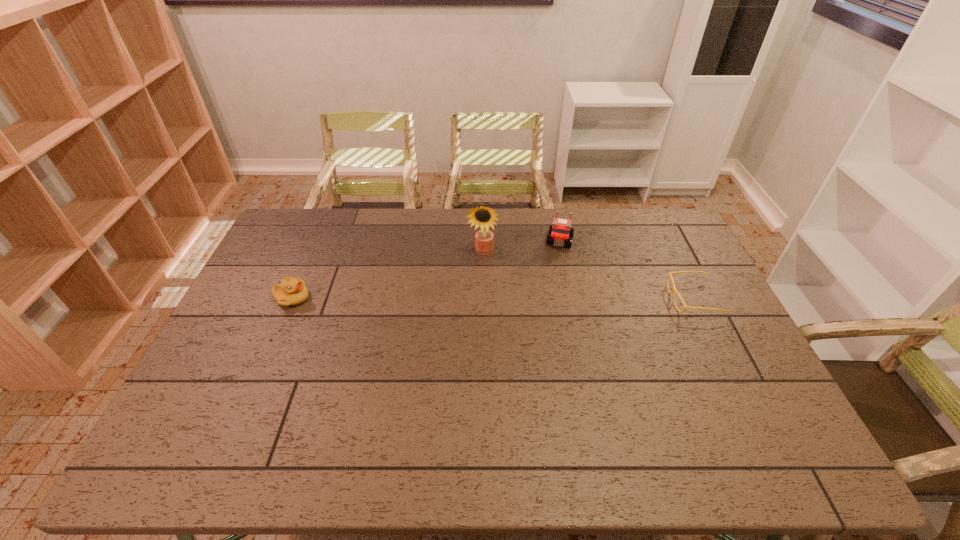
Identify the location of vacant space on the desktop that is between the third tallest object and the shortest object and is positioned on the face of the third object from right to left. The width and height of the screenshot is (960, 540). (472, 299).

You are a GUI agent. You are given a task and a screenshot of the screen. Output one action in this format:
    pyautogui.click(x=<x>, y=<y>)
    Task: Click on the vacant spot on the desktop that is between the leftmost object and the spectacles and is positioned on the front-facing side of the third shortest object
    
    Given the screenshot: What is the action you would take?
    pyautogui.click(x=548, y=299)